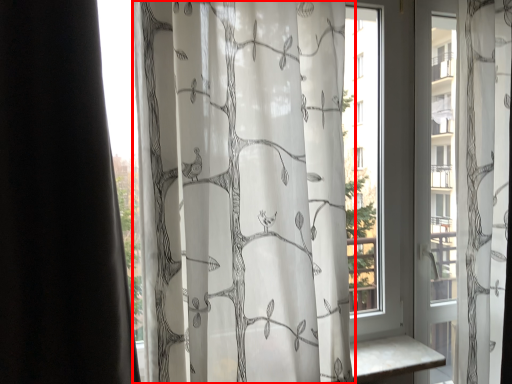
Question: Where is curtain (annotated by the red box) located in relation to window in the image?

Choices:
 (A) right
 (B) left

Answer: (B)